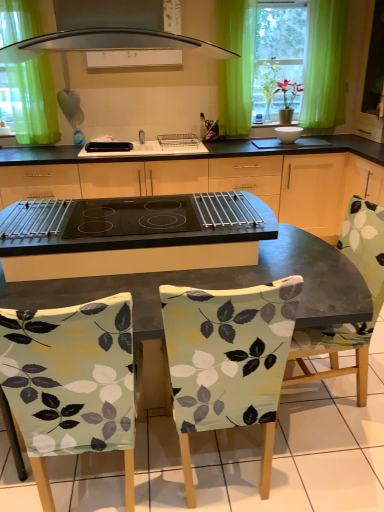
Identify the location of vacant space in green sheer curtain at upper center, which appears as the first curtain when viewed from the right (from a real-world perspective). This screenshot has width=384, height=512. (x=243, y=134).